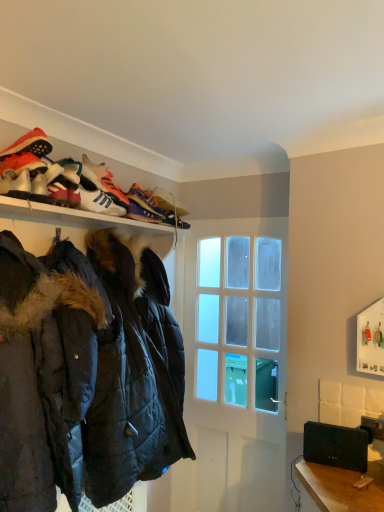
Question: Is multicolored fabric shoe at upper center, which ranks as the first shoe in back-to-front order, next to dark blue quilted jacket at left and touching it?

Choices:
 (A) no
 (B) yes

Answer: (A)

Question: Is the position of multicolored fabric shoe at upper center, which ranks as the first shoe in back-to-front order, more distant than that of dark blue quilted jacket at left?

Choices:
 (A) yes
 (B) no

Answer: (A)

Question: From the image's perspective, is multicolored fabric shoe at upper center, which ranks as the first shoe in back-to-front order, over dark blue quilted jacket at left?

Choices:
 (A) yes
 (B) no

Answer: (A)

Question: Can you confirm if multicolored fabric shoe at upper center, which is the 2th shoe from front to back, is thinner than dark blue quilted jacket at left?

Choices:
 (A) yes
 (B) no

Answer: (A)

Question: From a real-world perspective, is multicolored fabric shoe at upper center, which is the 2th shoe from front to back, located beneath dark blue quilted jacket at left?

Choices:
 (A) yes
 (B) no

Answer: (B)

Question: From their relative heights in the image, would you say dark blue quilted jacket at left is taller or shorter than matte black shoes at upper center, which is counted as the first footwear, starting from the back?

Choices:
 (A) tall
 (B) short

Answer: (A)

Question: Would you say dark blue quilted jacket at left is to the left or to the right of matte black shoes at upper center, which is counted as the first footwear, starting from the back, in the picture?

Choices:
 (A) left
 (B) right

Answer: (A)

Question: Looking at their shapes, would you say dark blue quilted jacket at left is wider or thinner than matte black shoes at upper center, which is counted as the first footwear, starting from the back?

Choices:
 (A) thin
 (B) wide

Answer: (B)

Question: Looking at the image, does dark blue quilted jacket at left seem bigger or smaller compared to matte black shoes at upper center, which is counted as the first footwear, starting from the back?

Choices:
 (A) big
 (B) small

Answer: (A)

Question: In the image, is clear glass door at center positioned in front of or behind white leather sneakers at upper center, the 1th shoe positioned from the front?

Choices:
 (A) front
 (B) behind

Answer: (B)

Question: In terms of size, does clear glass door at center appear bigger or smaller than white leather sneakers at upper center, marked as the 2th shoe in a back-to-front arrangement?

Choices:
 (A) small
 (B) big

Answer: (B)

Question: Does point (279, 375) appear closer or farther from the camera than point (91, 209)?

Choices:
 (A) closer
 (B) farther

Answer: (B)

Question: In terms of height, does clear glass door at center look taller or shorter compared to white leather sneakers at upper center, marked as the 2th shoe in a back-to-front arrangement?

Choices:
 (A) short
 (B) tall

Answer: (B)

Question: In terms of height, does white leather sneakers at upper center, which appears as the third footwear when viewed from the front, look taller or shorter compared to matte black shoes at upper center, which is counted as the first footwear, starting from the back?

Choices:
 (A) tall
 (B) short

Answer: (B)

Question: Considering the positions of white leather sneakers at upper center, placed as the second footwear when sorted from back to front, and matte black shoes at upper center, positioned as the 4th footwear in front-to-back order, in the image, is white leather sneakers at upper center, placed as the second footwear when sorted from back to front, bigger or smaller than matte black shoes at upper center, positioned as the 4th footwear in front-to-back order,?

Choices:
 (A) big
 (B) small

Answer: (A)